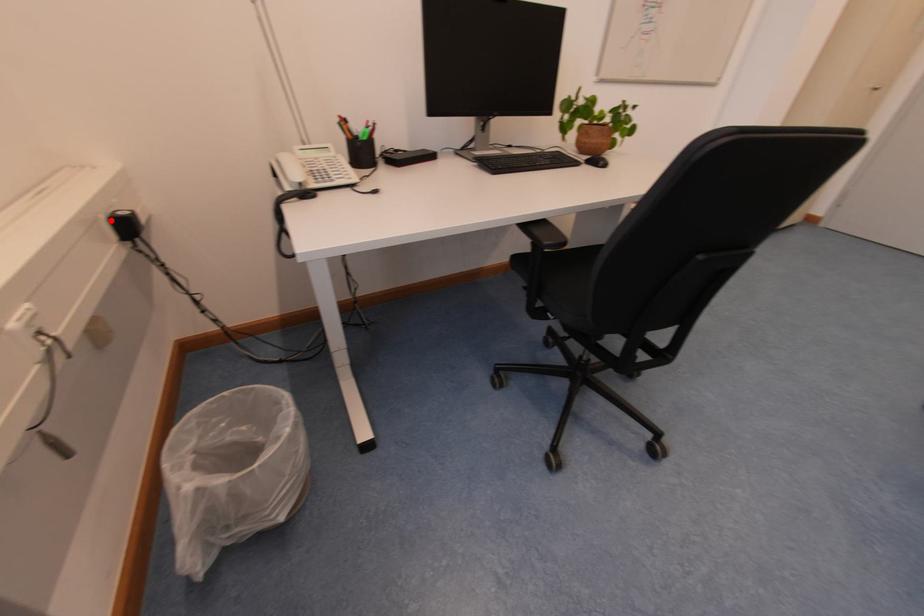
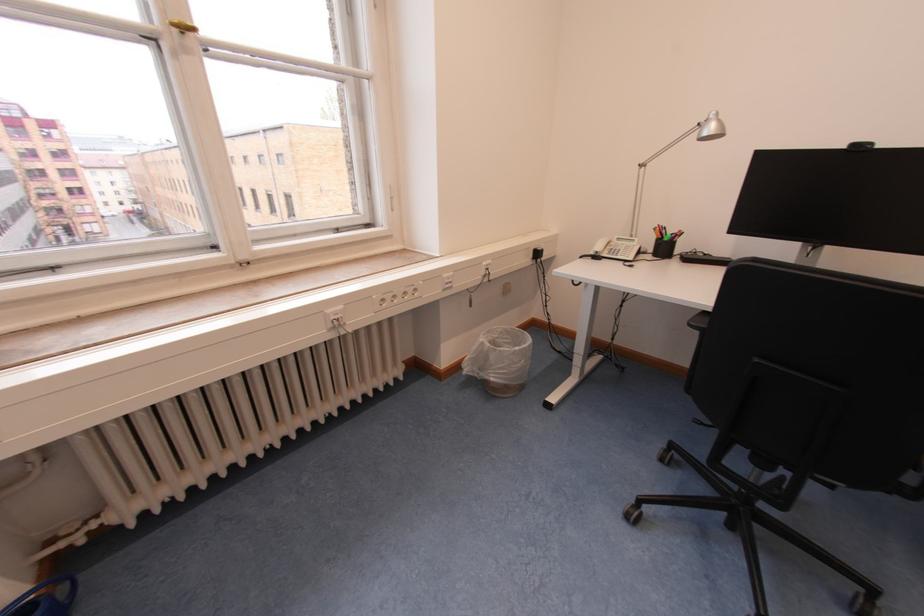
Find the pixel in the second image that matches the highlighted location in the first image.

(540, 251)